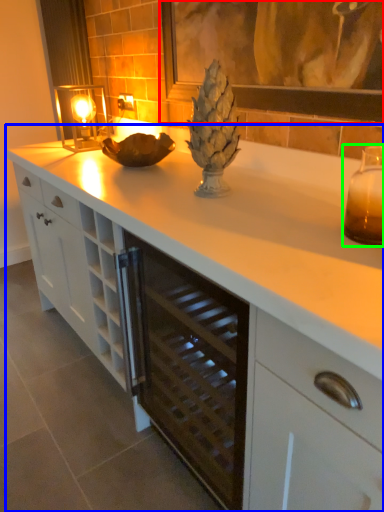
Question: Which is farther away from picture frame (highlighted by a red box)? countertop (highlighted by a blue box) or candle holder (highlighted by a green box)?

Choices:
 (A) countertop
 (B) candle holder

Answer: (A)